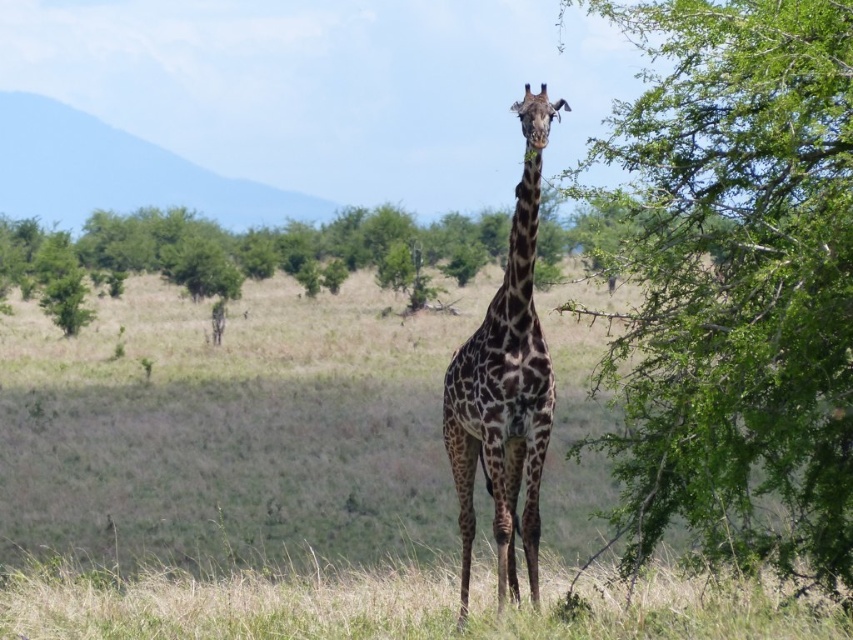
You are a photographer trying to capture a portrait of the giraffe. To ensure the green leafy tree at right does not block the giraffe in your shot, where should you position yourself relative to the giraffe?

The green leafy tree at right is located at coordinates point (735, 278), so positioning yourself to the left side of the giraffe would ensure the tree does not obstruct the view.

You are a photographer trying to capture the green leafy tree at right in your shot. You are currently standing 3 meters away from the tree. Do you need to move closer or farther away to frame the tree properly?

The green leafy tree at right is 5.66 meters away from the camera. Since you are currently 3 meters away, you need to move farther away to match the distance required for proper framing.

You are a photographer trying to capture the spotted fur giraffe at center and the green leafy tree at right in the same frame. Based on their positions, which object should you adjust your camera to focus on first to ensure both are in the shot?

The green leafy tree at right is to the right of the spotted fur giraffe at center, so you should focus on the spotted fur giraffe at center first to ensure both are in the frame.